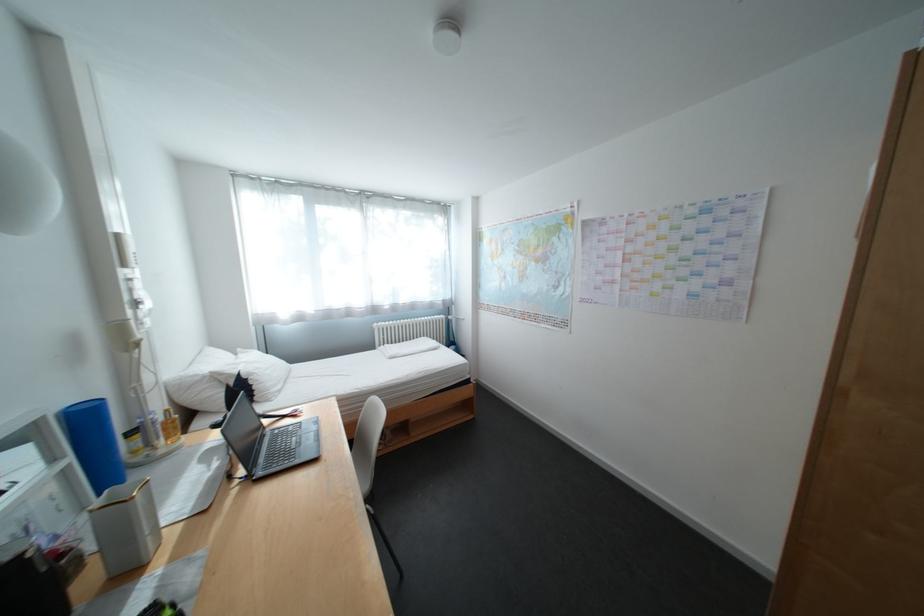
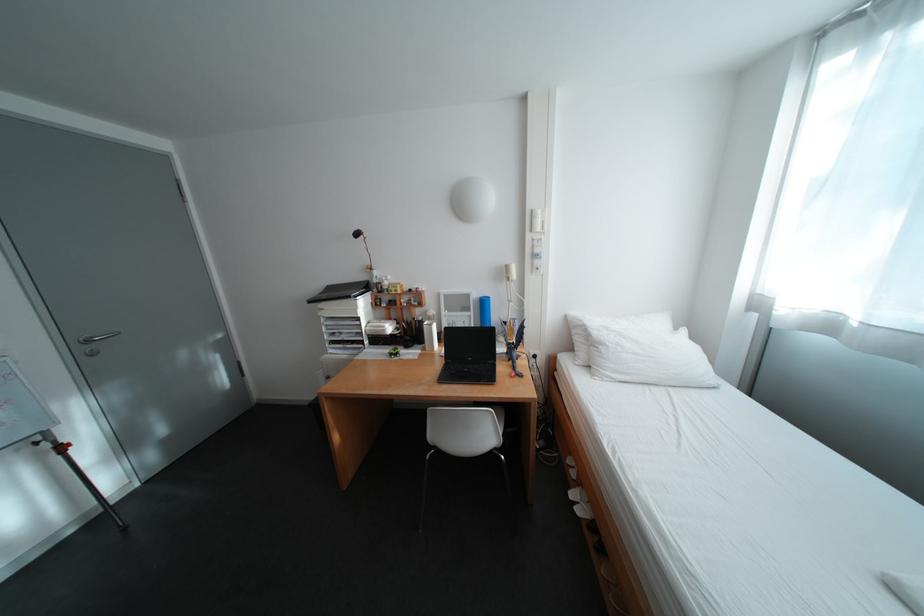
Find the pixel in the second image that matches the point at 56,570 in the first image.

(430, 326)